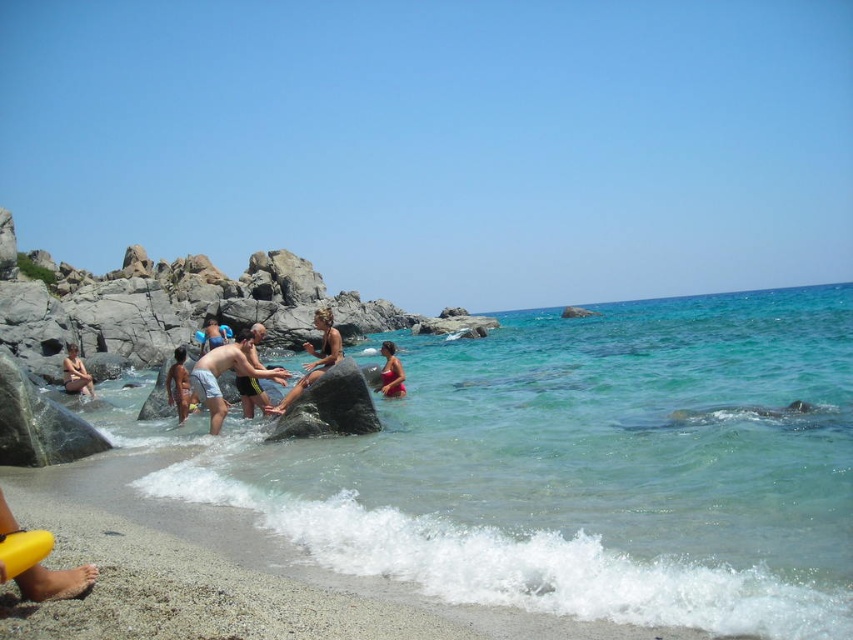
Consider the image. Is clear blue water at center positioned behind light blue shorts at center?

That is False.

Who is more distant from viewer, (x=223, y=458) or (x=212, y=356)?

The point (x=212, y=356) is more distant.

Who is more distant from viewer, (520,589) or (210,417)?

The point (210,417) is more distant.

Find the location of a particular element. The image size is (853, 640). clear blue water at center is located at coordinates (576, 467).

Is point (178, 406) less distant than point (67, 388)?

Yes, it is in front of point (67, 388).

Is tan skin human at center below matte skin person at lower left?

No, tan skin human at center is not below matte skin person at lower left.

Is point (187, 387) closer to camera compared to point (73, 381)?

Yes, it is.

At what (x,y) coordinates should I click in order to perform the action: click on tan skin human at center. Please return your answer as a coordinate pair (x, y). The height and width of the screenshot is (640, 853). Looking at the image, I should click on pyautogui.click(x=178, y=384).

Is point (746, 301) positioned in front of point (247, 387)?

That is False.

Is point (717, 417) positioned in front of point (257, 353)?

Yes, it is in front of point (257, 353).

Where is `clear blue water at center`? This screenshot has width=853, height=640. clear blue water at center is located at coordinates (576, 467).